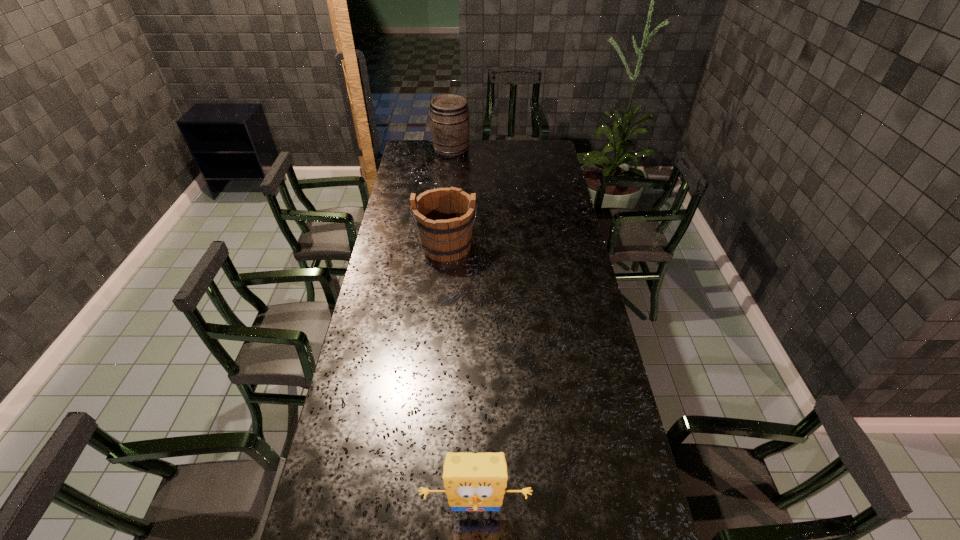
Find the location of `free space between the nearer wine bucket and the nearest object`. free space between the nearer wine bucket and the nearest object is located at coordinates (461, 378).

I want to click on free space between the farther wine bucket and the nearest object, so click(x=464, y=330).

Locate an element on the screen. The image size is (960, 540). object that can be found as the closest to the nearer wine bucket is located at coordinates coord(450,127).

You are a GUI agent. You are given a task and a screenshot of the screen. Output one action in this format:
    pyautogui.click(x=<x>, y=<y>)
    Task: Click on the object that is the closest to the nearest object
    This screenshot has width=960, height=540.
    Given the screenshot: What is the action you would take?
    pyautogui.click(x=443, y=217)